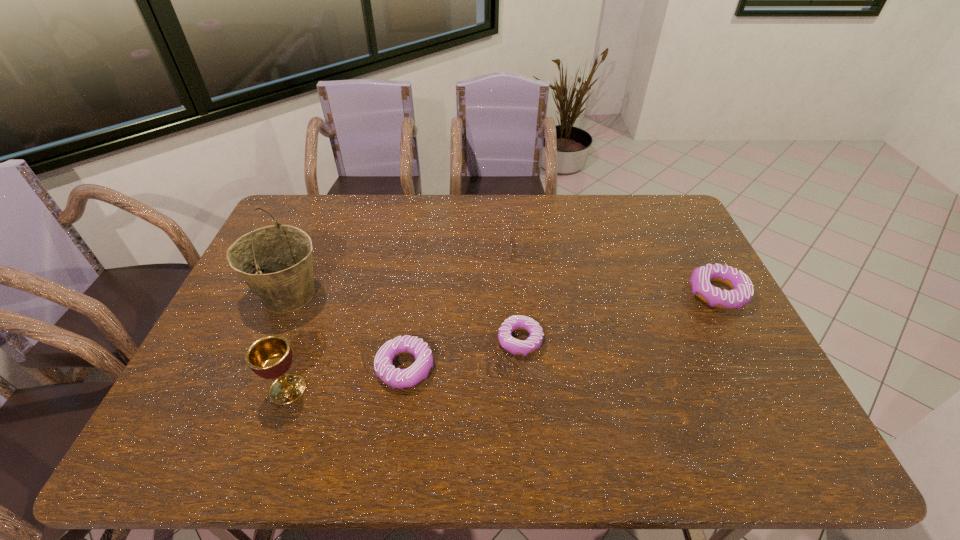
Where is `object present at the right edge`? This screenshot has height=540, width=960. object present at the right edge is located at coordinates (742, 290).

Locate an element on the screen. vacant region at the far edge is located at coordinates (540, 225).

In the image, there is a desktop. Where is `free space at the left edge`? The image size is (960, 540). free space at the left edge is located at coordinates (230, 327).

Image resolution: width=960 pixels, height=540 pixels. Find the location of `free point at the right edge`. free point at the right edge is located at coordinates (713, 356).

In the image, there is a desktop. Where is `vacant space at the far left corner`? vacant space at the far left corner is located at coordinates (303, 227).

You are a GUI agent. You are given a task and a screenshot of the screen. Output one action in this format:
    pyautogui.click(x=<x>, y=<y>)
    Task: Click on the vacant space at the near right corner
    This screenshot has height=540, width=960.
    Given the screenshot: What is the action you would take?
    point(762,400)

Locate an element on the screen. The image size is (960, 540). free area in between the wine bucket and the farthest doughnut is located at coordinates (503, 295).

You are a GUI agent. You are given a task and a screenshot of the screen. Output one action in this format:
    pyautogui.click(x=<x>, y=<y>)
    Task: Click on the vacant region between the rightmost doughnut and the farthest object
    The width and height of the screenshot is (960, 540).
    Given the screenshot: What is the action you would take?
    (623, 272)

Where is `free space between the second doughnut from left to right and the chalice`? free space between the second doughnut from left to right and the chalice is located at coordinates (404, 365).

This screenshot has width=960, height=540. Identify the location of vacant space in between the shortest object and the leftmost doughnut. (463, 354).